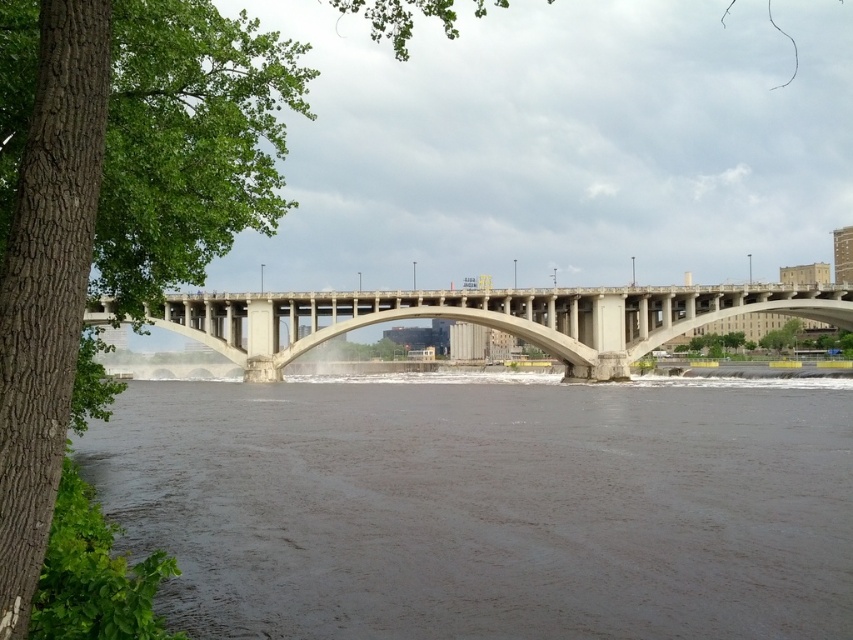
Question: Estimate the real-world distances between objects in this image. Which object is closer to the concrete bridge at center?

Choices:
 (A) brown muddy water at center
 (B) green rough bark tree at left

Answer: (A)

Question: Does brown muddy water at center appear over concrete bridge at center?

Choices:
 (A) yes
 (B) no

Answer: (B)

Question: Which point appears closest to the camera in this image?

Choices:
 (A) (279, 556)
 (B) (546, 305)
 (C) (32, 136)

Answer: (C)

Question: Considering the relative positions of brown muddy water at center and concrete bridge at center in the image provided, where is brown muddy water at center located with respect to concrete bridge at center?

Choices:
 (A) above
 (B) below

Answer: (B)

Question: Based on their relative distances, which object is farther from the concrete bridge at center?

Choices:
 (A) brown muddy water at center
 (B) green rough bark tree at left

Answer: (B)

Question: Does brown muddy water at center appear over green rough bark tree at left?

Choices:
 (A) yes
 (B) no

Answer: (B)